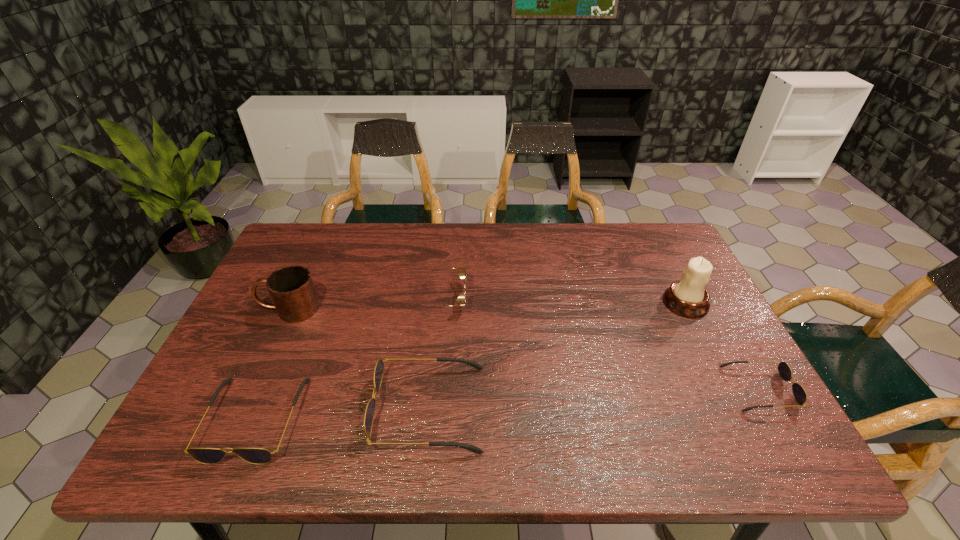
The width and height of the screenshot is (960, 540). In the image, there is a desktop. Find the location of `free region at the far right corner`. free region at the far right corner is located at coordinates (662, 257).

This screenshot has width=960, height=540. In order to click on free space between the leftmost sunglasses and the farthest sunglasses in this screenshot , I will do `click(348, 359)`.

Where is `free space between the shortest sunglasses and the candle holder`? This screenshot has width=960, height=540. free space between the shortest sunglasses and the candle holder is located at coordinates (722, 346).

You are a GUI agent. You are given a task and a screenshot of the screen. Output one action in this format:
    pyautogui.click(x=<x>, y=<y>)
    Task: Click on the empty location between the tallest object and the leftmost sunglasses
    
    Given the screenshot: What is the action you would take?
    pyautogui.click(x=470, y=361)

Identify the location of free spot between the farthest sunglasses and the candle holder. (564, 301).

At what (x,y) coordinates should I click in order to perform the action: click on empty location between the tallest object and the leftmost sunglasses. Please return your answer as a coordinate pair (x, y). Image resolution: width=960 pixels, height=540 pixels. Looking at the image, I should click on coord(470,361).

At what (x,y) coordinates should I click in order to perform the action: click on free space between the second shortest sunglasses and the shortest object. Please return your answer as a coordinate pair (x, y). Looking at the image, I should click on (507, 404).

Identify the location of vacant region between the candle holder and the farthest sunglasses. (564, 301).

I want to click on object that ranks as the closest to the fifth tallest object, so click(379, 367).

Locate an element on the screen. This screenshot has width=960, height=540. object that is the fifth nearest to the shortest sunglasses is located at coordinates (291, 288).